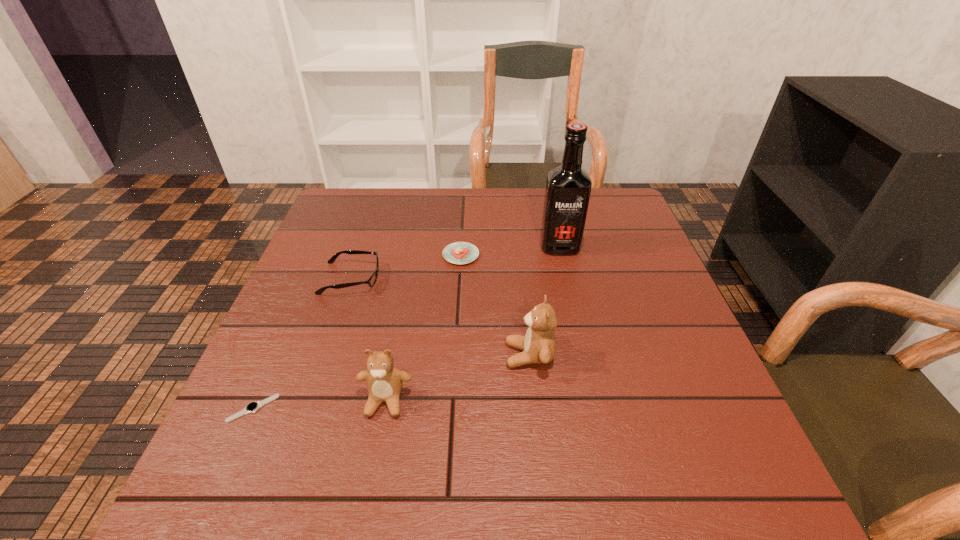
Locate an element on the screen. the third tallest object is located at coordinates (384, 381).

What are the coordinates of `the nearer teddy bear` in the screenshot? It's located at (384, 381).

Where is `the right teddy bear`? the right teddy bear is located at coordinates (538, 345).

Identify the location of the second object from right to left. (538, 345).

The width and height of the screenshot is (960, 540). Identify the location of pastry. (459, 252).

Find the location of a particular element. the third object from right to left is located at coordinates (459, 252).

At what (x,y) coordinates should I click in order to perform the action: click on spectacles. Please return your answer as a coordinate pair (x, y). The image size is (960, 540). Looking at the image, I should click on (371, 281).

This screenshot has width=960, height=540. I want to click on liquor, so click(568, 187).

The image size is (960, 540). Find the location of `the rightmost object`. the rightmost object is located at coordinates (568, 187).

The height and width of the screenshot is (540, 960). What are the coordinates of `watch` in the screenshot? It's located at (252, 407).